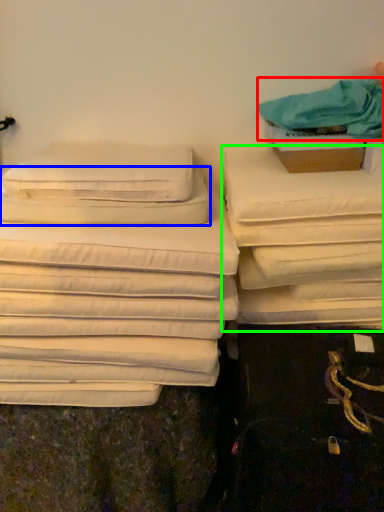
Question: Estimate the real-world distances between objects in this image. Which object is closer to cloth (highlighted by a red box), pillow (highlighted by a blue box) or furniture (highlighted by a green box)?

Choices:
 (A) pillow
 (B) furniture

Answer: (B)